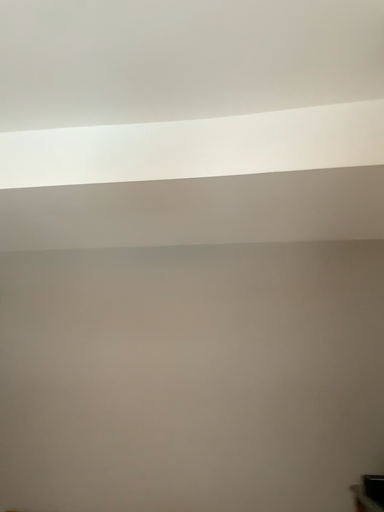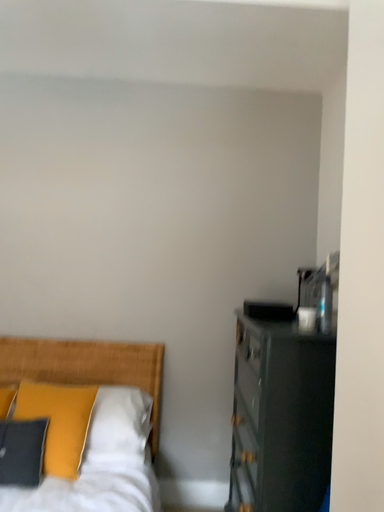
Question: Which way did the camera rotate in the video?

Choices:
 (A) rotated upward
 (B) rotated downward

Answer: (B)